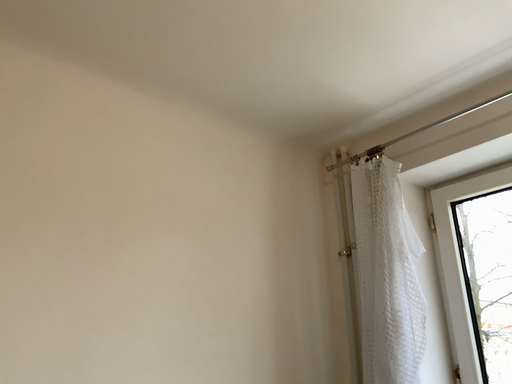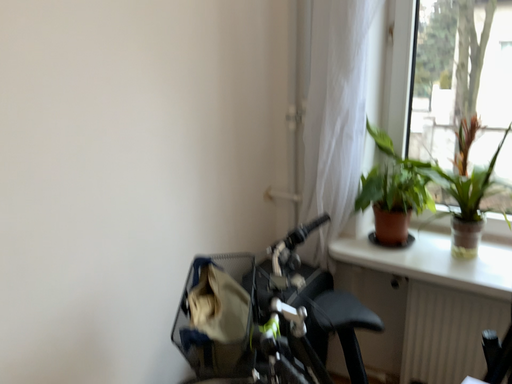
Question: Which way did the camera rotate in the video?

Choices:
 (A) rotated left
 (B) rotated right

Answer: (B)